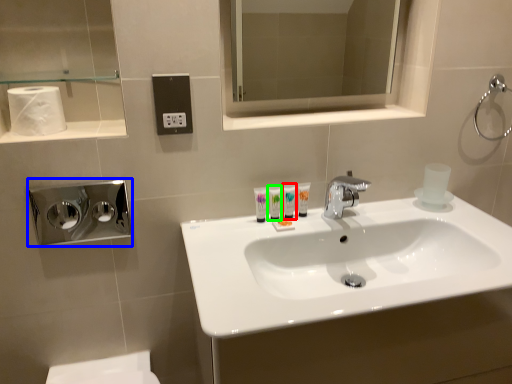
Question: Based on their relative distances, which object is farther from toiletry (highlighted by a red box)? Choose from hand dryer (highlighted by a blue box) and toiletry (highlighted by a green box).

Choices:
 (A) hand dryer
 (B) toiletry

Answer: (A)